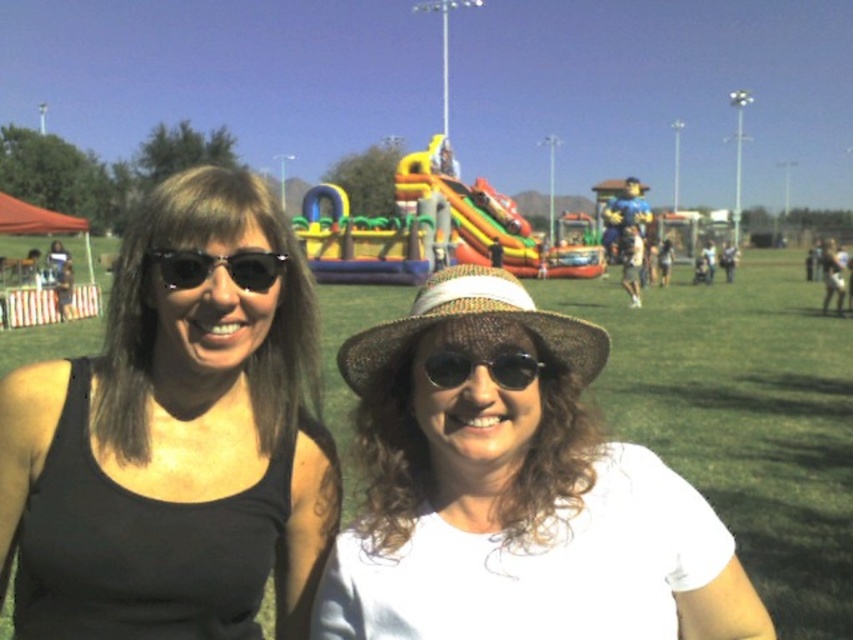
How far apart are black matte tank top at center and black reflective sunglasses at left?

black matte tank top at center and black reflective sunglasses at left are 13.08 inches apart.

Can you confirm if black matte tank top at center is positioned below black reflective sunglasses at left?

Indeed, black matte tank top at center is positioned under black reflective sunglasses at left.

Which is in front, point (30, 397) or point (173, 260)?

Point (173, 260)

Find the location of a particular element. black matte tank top at center is located at coordinates 175,440.

Between black matte tank top at center and white woven hat at center, which one has less height?

white woven hat at center is shorter.

Between black matte tank top at center and white woven hat at center, which one appears on the left side from the viewer's perspective?

From the viewer's perspective, black matte tank top at center appears more on the left side.

The image size is (853, 640). Identify the location of black matte tank top at center. (x=175, y=440).

Can you confirm if black matte tank top at center is positioned below black reflective sunglasses at center?

Yes, black matte tank top at center is below black reflective sunglasses at center.

Is black matte tank top at center taller than black reflective sunglasses at center?

Indeed, black matte tank top at center has a greater height compared to black reflective sunglasses at center.

Between point (45, 472) and point (450, 380), which one is positioned behind?

Positioned behind is point (450, 380).

At what (x,y) coordinates should I click in order to perform the action: click on black matte tank top at center. Please return your answer as a coordinate pair (x, y). This screenshot has height=640, width=853. Looking at the image, I should click on (175, 440).